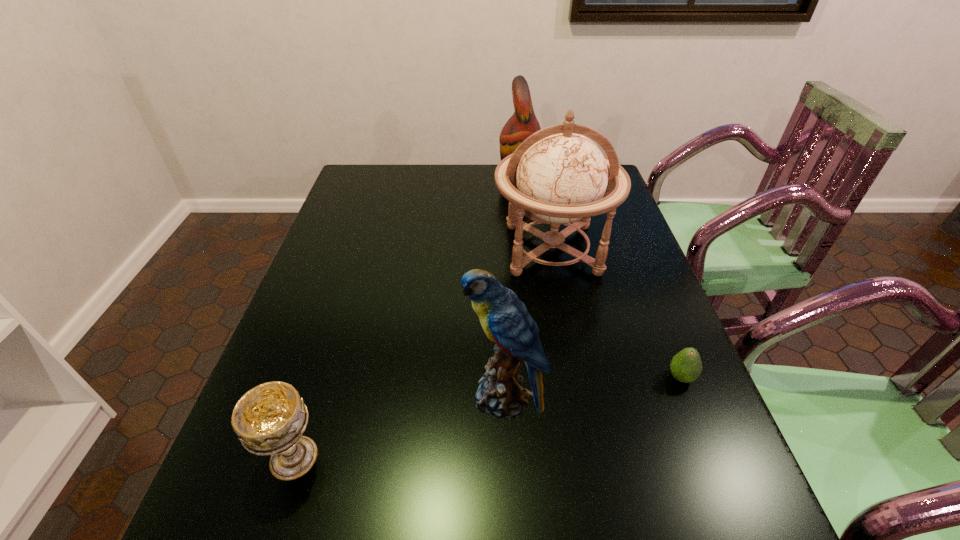
Locate an element on the screen. The width and height of the screenshot is (960, 540). the fourth nearest object is located at coordinates (556, 176).

Locate an element on the screen. Image resolution: width=960 pixels, height=540 pixels. globe is located at coordinates (556, 176).

Find the location of a particular element. the farthest object is located at coordinates click(523, 123).

At what (x,y) coordinates should I click in order to perform the action: click on the nearer parrot. Please return your answer as a coordinate pair (x, y). This screenshot has height=540, width=960. Looking at the image, I should click on (504, 318).

The height and width of the screenshot is (540, 960). Find the location of `chalice`. chalice is located at coordinates (269, 419).

This screenshot has height=540, width=960. In order to click on the second shortest object in this screenshot , I will do `click(269, 419)`.

Locate an element on the screen. the shortest object is located at coordinates (686, 366).

Find the location of a particular element. The image size is (960, 540). avocado is located at coordinates (686, 366).

Find the location of a particular element. The image size is (960, 540). vacant area located on the front-facing side of the fourth nearest object is located at coordinates (574, 366).

This screenshot has width=960, height=540. I want to click on vacant space located 0.190m on the face of the farther parrot, so click(445, 178).